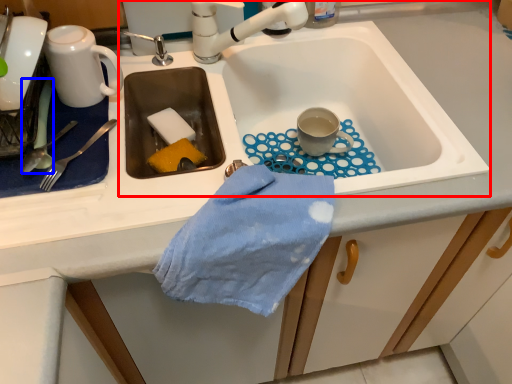
Question: Which point is further to the camera, sink (highlighted by a red box) or silverware (highlighted by a blue box)?

Choices:
 (A) sink
 (B) silverware

Answer: (B)